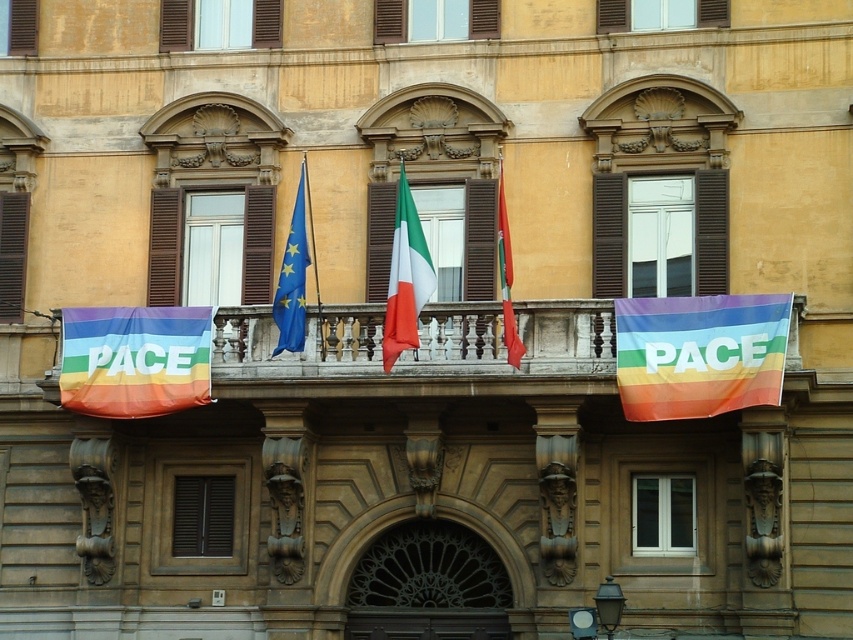
Question: Which point appears closest to the camera in this image?

Choices:
 (A) (198, 358)
 (B) (305, 269)

Answer: (B)

Question: Which of the following is the closest to the observer?

Choices:
 (A) (387, 316)
 (B) (299, 289)
 (C) (500, 244)
 (D) (62, 397)

Answer: (A)

Question: Can you confirm if rainbow fabric banner at center is thinner than rainbow fabric banner at left?

Choices:
 (A) no
 (B) yes

Answer: (A)

Question: Can you confirm if white cotton flag at center is positioned below matte fabric flag at center?

Choices:
 (A) yes
 (B) no

Answer: (B)

Question: Which point is closer to the camera?

Choices:
 (A) (103, 403)
 (B) (735, 305)

Answer: (B)

Question: Can you confirm if blue fabric flag at center is positioned to the left of matte fabric flag at center?

Choices:
 (A) no
 (B) yes

Answer: (B)